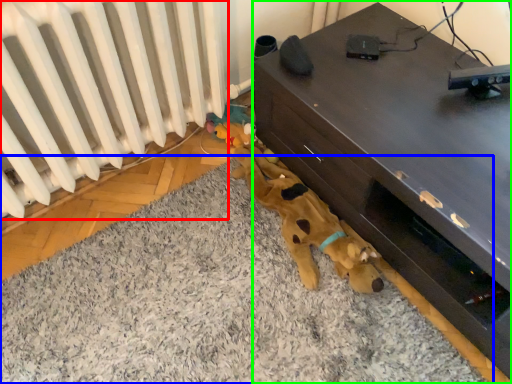
Question: Estimate the real-world distances between objects in this image. Which object is closer to radiator (highlighted by a red box), mat (highlighted by a blue box) or furniture (highlighted by a green box)?

Choices:
 (A) mat
 (B) furniture

Answer: (A)